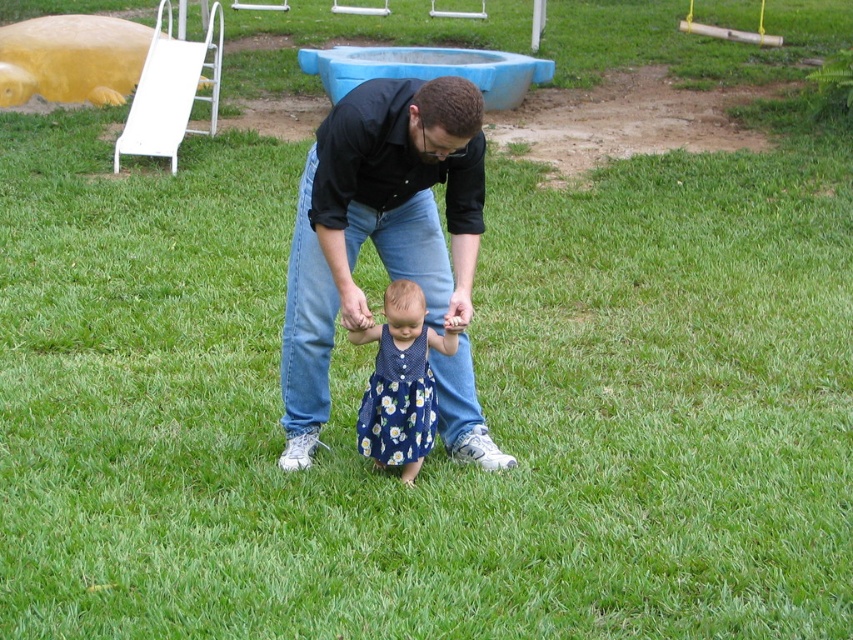
Question: Among these objects, which one is farthest from the camera?

Choices:
 (A) black cotton shirt at center
 (B) blue floral dress at center

Answer: (B)

Question: Is black cotton shirt at center above blue floral dress at center?

Choices:
 (A) no
 (B) yes

Answer: (B)

Question: Can you confirm if black cotton shirt at center is bigger than blue floral dress at center?

Choices:
 (A) no
 (B) yes

Answer: (B)

Question: Which point is farther to the camera?

Choices:
 (A) black cotton shirt at center
 (B) blue floral dress at center

Answer: (B)

Question: Is black cotton shirt at center smaller than blue floral dress at center?

Choices:
 (A) yes
 (B) no

Answer: (B)

Question: Which object appears closest to the camera in this image?

Choices:
 (A) black cotton shirt at center
 (B) blue floral dress at center

Answer: (A)